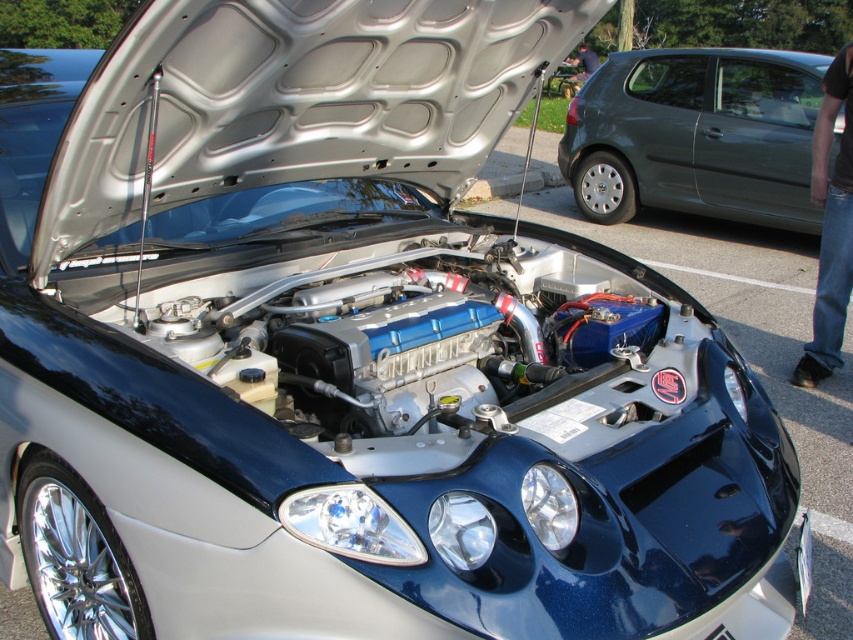
The width and height of the screenshot is (853, 640). Identify the location of metallic gray hatchback at right. (695, 134).

The image size is (853, 640). What do you see at coordinates (695, 134) in the screenshot?
I see `metallic gray hatchback at right` at bounding box center [695, 134].

Locate an element on the screen. metallic gray hatchback at right is located at coordinates (695, 134).